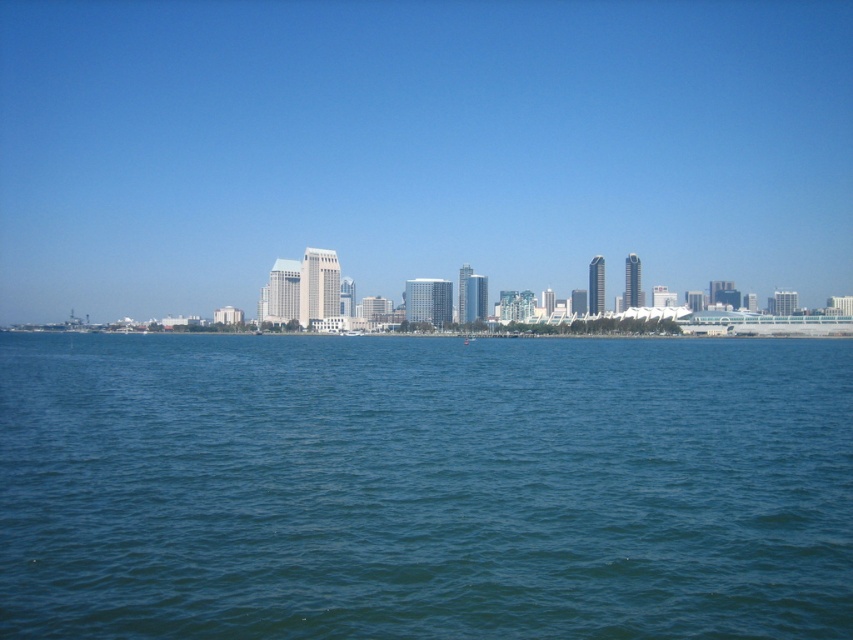
At what (x,y) coordinates should I click in order to perform the action: click on blue water at center. Please return your answer as a coordinate pair (x, y). This screenshot has height=640, width=853. Looking at the image, I should click on (424, 486).

Based on the photo, who is more forward, (x=207, y=449) or (x=813, y=54)?

Point (x=207, y=449) is more forward.

At what (x,y) coordinates should I click in order to perform the action: click on blue water at center. Please return your answer as a coordinate pair (x, y). The width and height of the screenshot is (853, 640). Looking at the image, I should click on (424, 486).

This screenshot has width=853, height=640. I want to click on blue water at center, so click(424, 486).